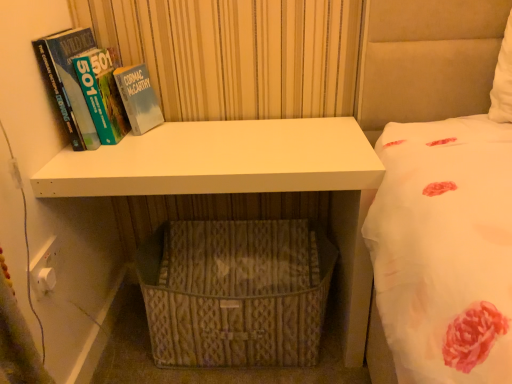
Question: From the image's perspective, is woven beige basket at lower center beneath white matte shelf at center?

Choices:
 (A) no
 (B) yes

Answer: (B)

Question: Can you confirm if woven beige basket at lower center is bigger than white matte shelf at center?

Choices:
 (A) no
 (B) yes

Answer: (A)

Question: Is woven beige basket at lower center thinner than white matte shelf at center?

Choices:
 (A) no
 (B) yes

Answer: (A)

Question: From a real-world perspective, is woven beige basket at lower center located beneath white matte shelf at center?

Choices:
 (A) yes
 (B) no

Answer: (A)

Question: Are woven beige basket at lower center and white matte shelf at center far apart?

Choices:
 (A) yes
 (B) no

Answer: (B)

Question: In terms of size, does woven beige basket at lower center appear bigger or smaller than white matte shelf at center?

Choices:
 (A) small
 (B) big

Answer: (A)

Question: Choose the correct answer: Is woven beige basket at lower center inside white matte shelf at center or outside it?

Choices:
 (A) outside
 (B) inside

Answer: (B)

Question: From a real-world perspective, is woven beige basket at lower center positioned above or below white matte shelf at center?

Choices:
 (A) below
 (B) above

Answer: (A)

Question: Looking at their shapes, would you say woven beige basket at lower center is wider or thinner than white matte shelf at center?

Choices:
 (A) thin
 (B) wide

Answer: (B)

Question: Considering the positions of woven beige basket at lower center and hardcover book at left in the image, is woven beige basket at lower center bigger or smaller than hardcover book at left?

Choices:
 (A) big
 (B) small

Answer: (A)

Question: Is point (148, 304) positioned closer to the camera than point (123, 125)?

Choices:
 (A) closer
 (B) farther

Answer: (A)

Question: From the image's perspective, relative to hardcover book at left, is woven beige basket at lower center above or below?

Choices:
 (A) below
 (B) above

Answer: (A)

Question: From a real-world perspective, relative to hardcover book at left, is woven beige basket at lower center vertically above or below?

Choices:
 (A) above
 (B) below

Answer: (B)

Question: In the image, is white matte shelf at center on the left side or the right side of woven beige basket at lower center?

Choices:
 (A) right
 (B) left

Answer: (B)

Question: From the image's perspective, is white matte shelf at center located above or below woven beige basket at lower center?

Choices:
 (A) below
 (B) above

Answer: (B)